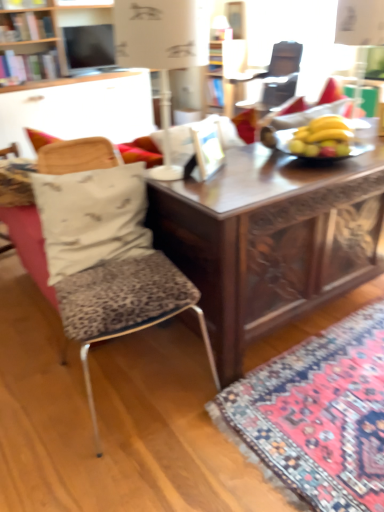
Find the location of `vacant point to the left of leopard print fabric chair at left`. vacant point to the left of leopard print fabric chair at left is located at coordinates (35, 395).